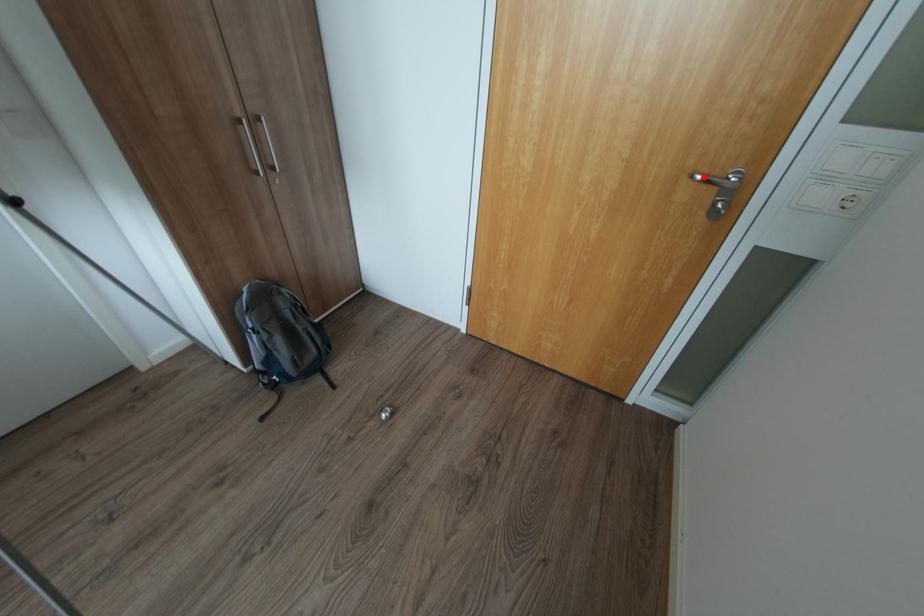
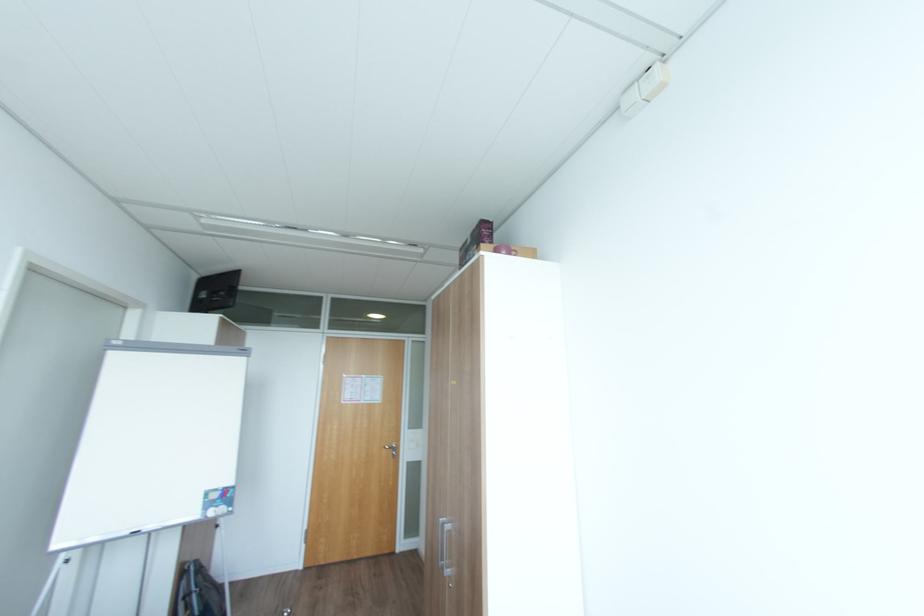
Locate, in the second image, the point that corresponds to the highlighted location in the first image.

(392, 448)